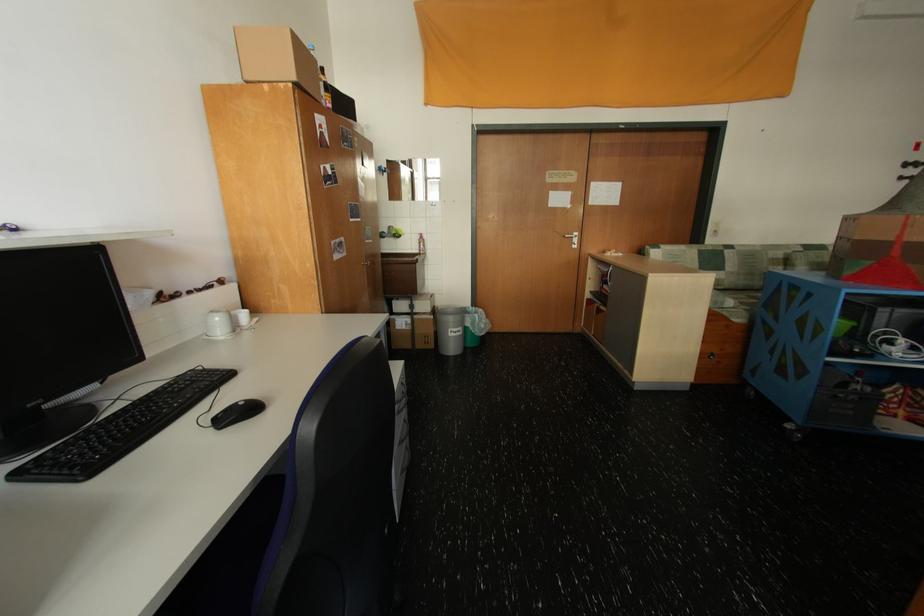
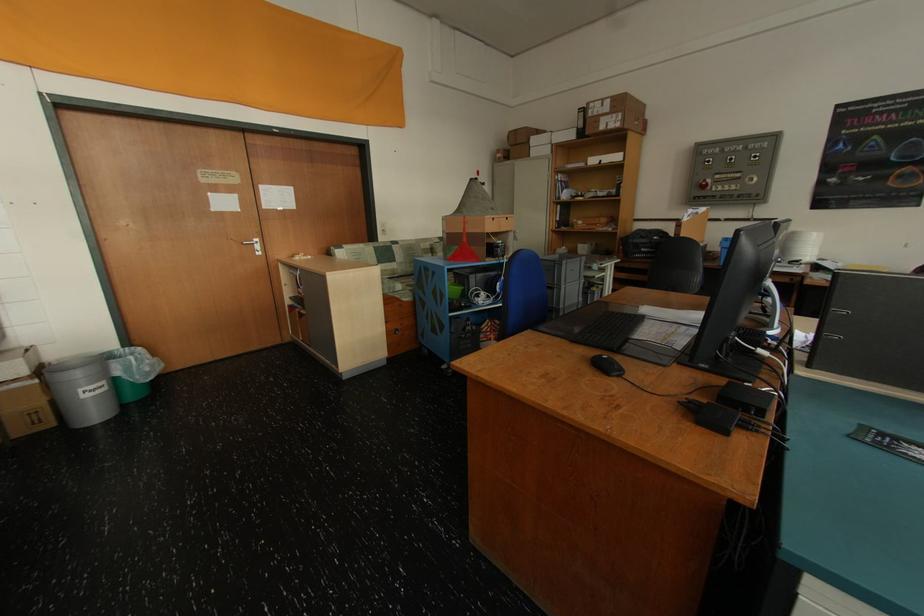
Locate, in the second image, the point that corresponds to point (879, 264) in the first image.

(465, 249)